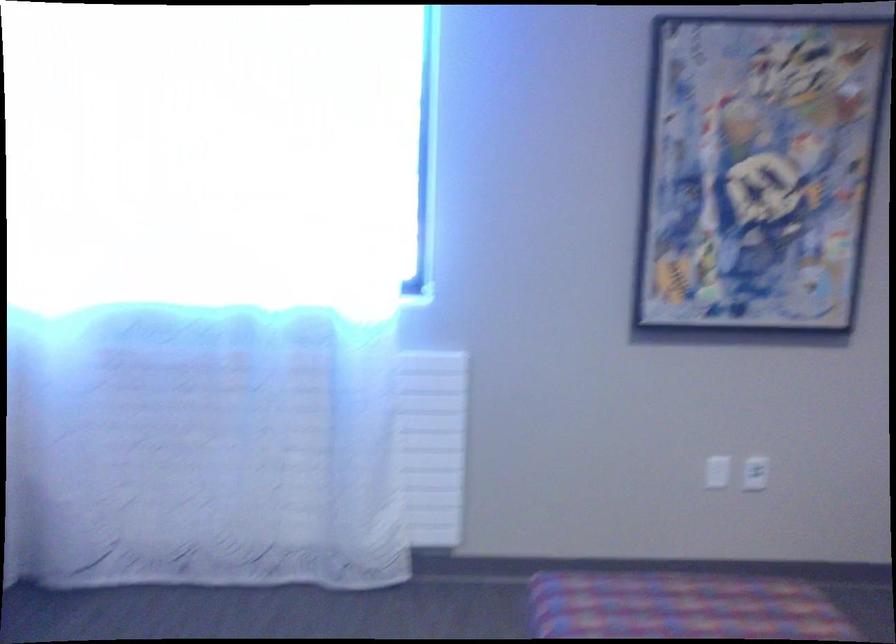
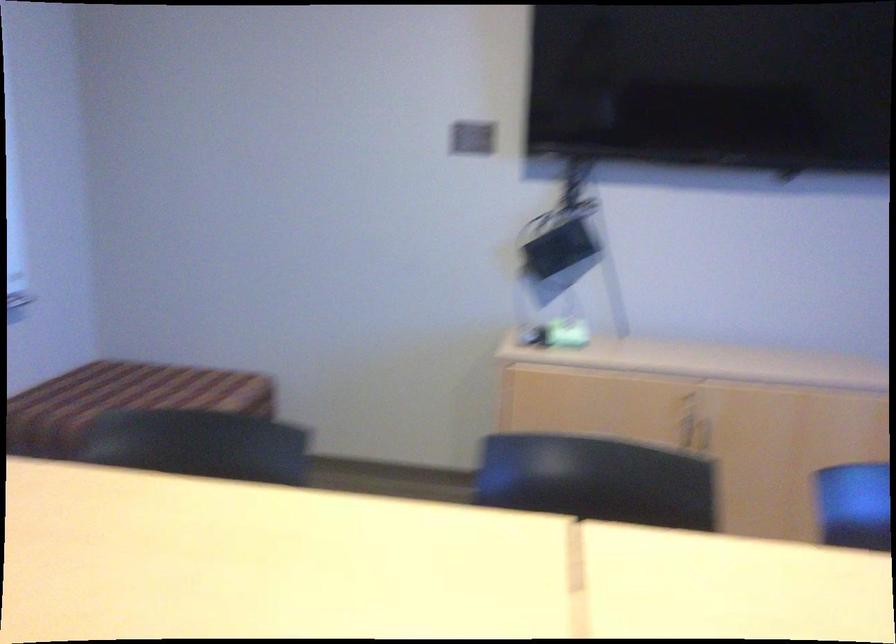
Question: How did the camera likely rotate?

Choices:
 (A) Left
 (B) Right
 (C) Up
 (D) Down

Answer: (A)